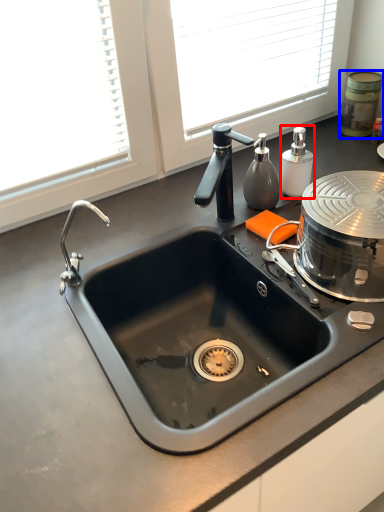
Question: Among these objects, which one is nearest to the camera, soap dispenser (highlighted by a red box) or appliance (highlighted by a blue box)?

Choices:
 (A) soap dispenser
 (B) appliance

Answer: (A)